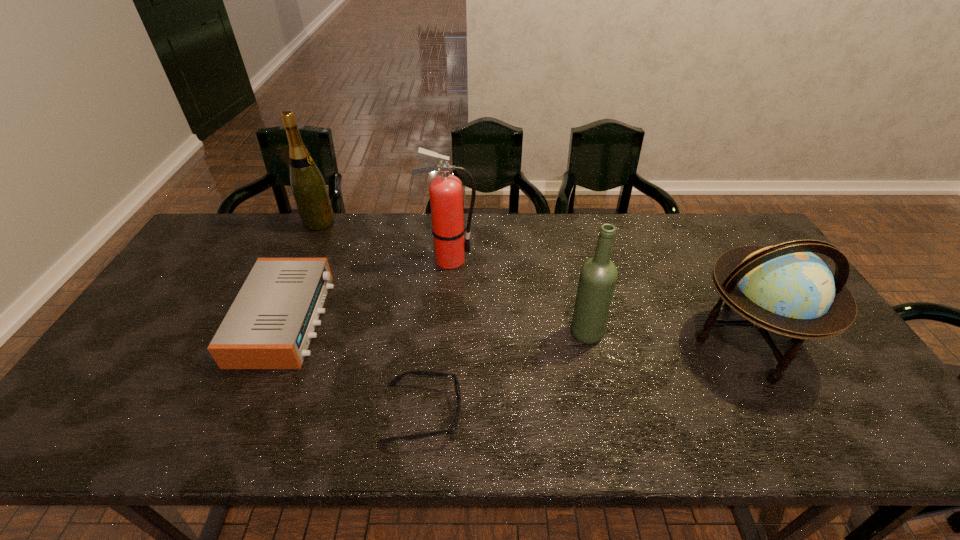
The width and height of the screenshot is (960, 540). Identify the location of free space in the image that satisfies the following two spatial constraints: 1. on the surface of the rightmost object; 2. on the front-facing side of the shortest object. [789, 413].

Locate an element on the screen. Image resolution: width=960 pixels, height=540 pixels. blank area in the image that satisfies the following two spatial constraints: 1. on the front side of the fifth object from left to right; 2. on the front-facing side of the spectacles is located at coordinates (604, 413).